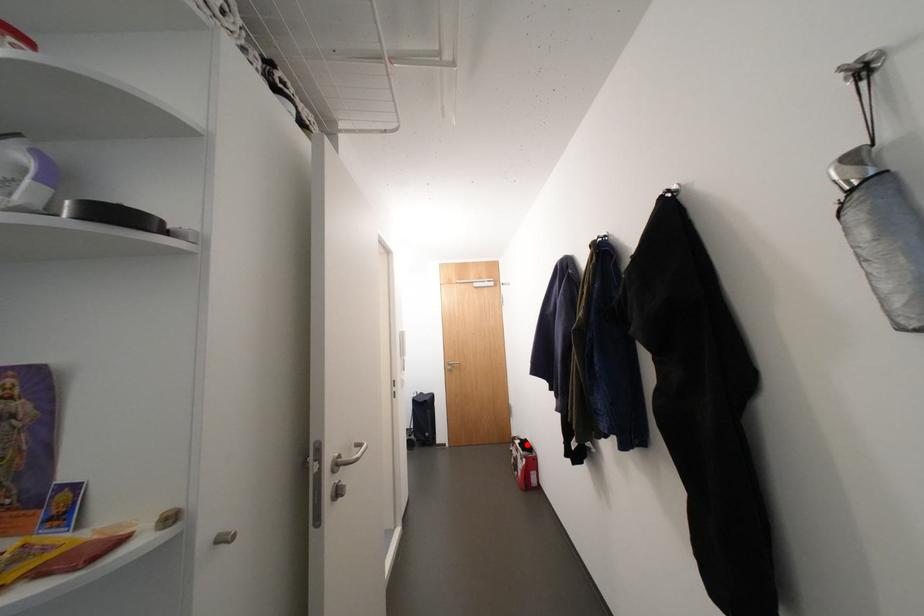
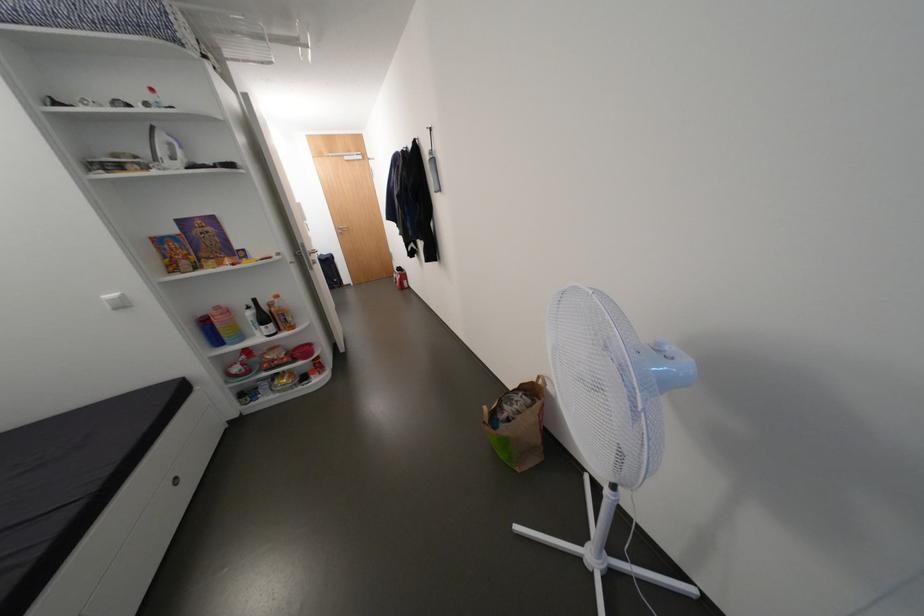
Question: A red point is marked in image1. In image2, is the corresponding 3D point closer to the camera or farther? Reply with the corresponding letter.

Choices:
 (A) The corresponding 3D point is closer.
 (B) The corresponding 3D point is farther.

Answer: (A)